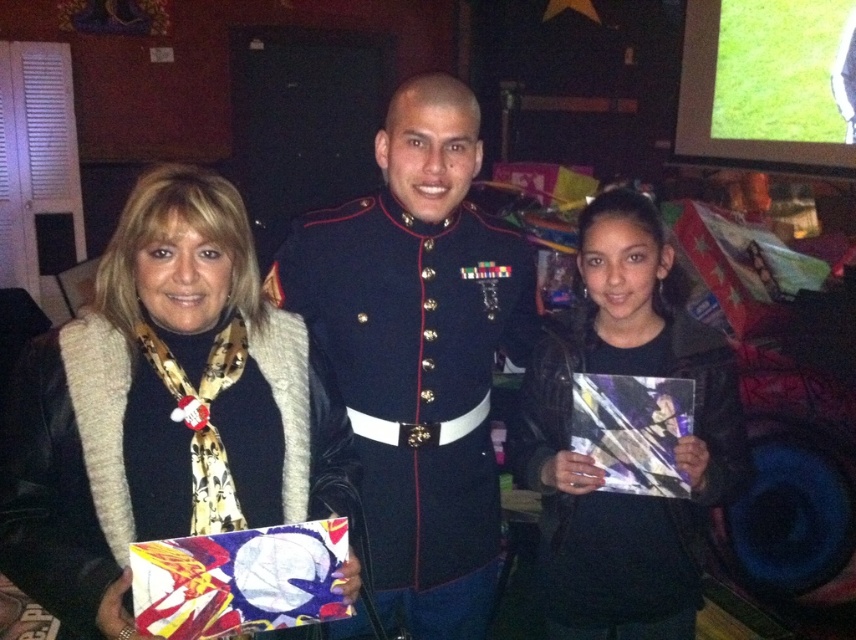
You are a photographer setting up for a group photo. You need to ensure there is enough space between the matte black jacket at left and the navy blue fabric uniform at center for a professional look. The recommended spacing between subjects in such photos is at least 30 centimeters. Based on the scene, is the current distance sufficient?

The distance between the matte black jacket at left and the navy blue fabric uniform at center is 27.75 centimeters, which is less than the recommended 30 centimeters. Therefore, the current spacing is insufficient for the professional look required.